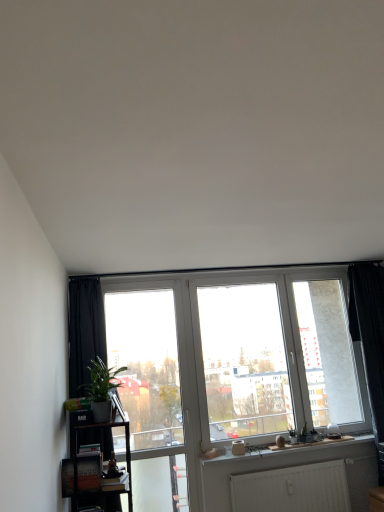
Question: Can you confirm if black fabric curtain at right is bigger than black wooden shelf at lower left?

Choices:
 (A) no
 (B) yes

Answer: (B)

Question: Is black fabric curtain at right facing towards black wooden shelf at lower left?

Choices:
 (A) no
 (B) yes

Answer: (A)

Question: Does black fabric curtain at right contain black wooden shelf at lower left?

Choices:
 (A) yes
 (B) no

Answer: (B)

Question: From a real-world perspective, does black fabric curtain at right sit lower than black wooden shelf at lower left?

Choices:
 (A) yes
 (B) no

Answer: (B)

Question: Considering the relative sizes of black fabric curtain at right and black wooden shelf at lower left in the image provided, is black fabric curtain at right shorter than black wooden shelf at lower left?

Choices:
 (A) yes
 (B) no

Answer: (B)

Question: Is green leafy plant at left bigger or smaller than transparent glass screen door at center?

Choices:
 (A) small
 (B) big

Answer: (A)

Question: From a real-world perspective, is green leafy plant at left physically located above or below transparent glass screen door at center?

Choices:
 (A) above
 (B) below

Answer: (A)

Question: Considering their positions, is green leafy plant at left located in front of or behind transparent glass screen door at center?

Choices:
 (A) behind
 (B) front

Answer: (B)

Question: From the image's perspective, relative to transparent glass screen door at center, is green leafy plant at left above or below?

Choices:
 (A) above
 (B) below

Answer: (A)

Question: From the image's perspective, is transparent glass screen door at center above or below black wooden shelf at lower left?

Choices:
 (A) above
 (B) below

Answer: (A)

Question: In terms of height, does transparent glass screen door at center look taller or shorter compared to black wooden shelf at lower left?

Choices:
 (A) short
 (B) tall

Answer: (B)

Question: Based on their sizes in the image, would you say transparent glass screen door at center is bigger or smaller than black wooden shelf at lower left?

Choices:
 (A) big
 (B) small

Answer: (B)

Question: Visually, is transparent glass screen door at center positioned to the left or to the right of black wooden shelf at lower left?

Choices:
 (A) right
 (B) left

Answer: (A)

Question: Is green leafy plant at left to the left or to the right of black fabric curtain at right in the image?

Choices:
 (A) left
 (B) right

Answer: (A)

Question: From a real-world perspective, is green leafy plant at left above or below black fabric curtain at right?

Choices:
 (A) below
 (B) above

Answer: (B)